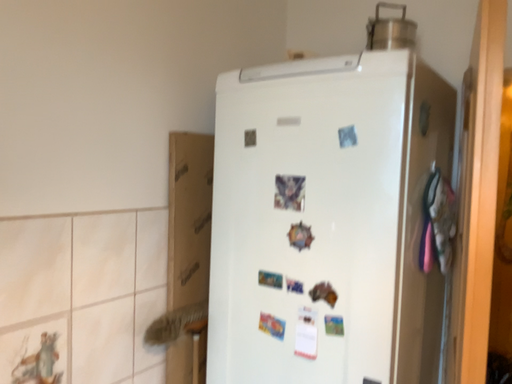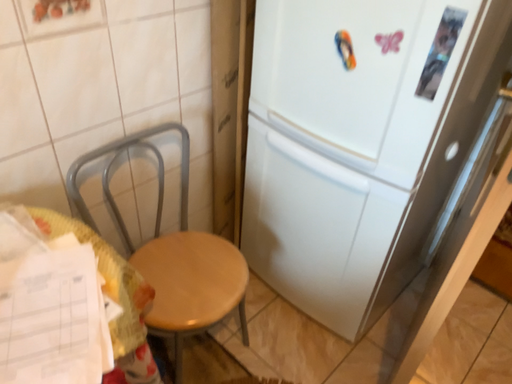
Question: How did the camera likely rotate when shooting the video?

Choices:
 (A) rotated right
 (B) rotated left

Answer: (B)